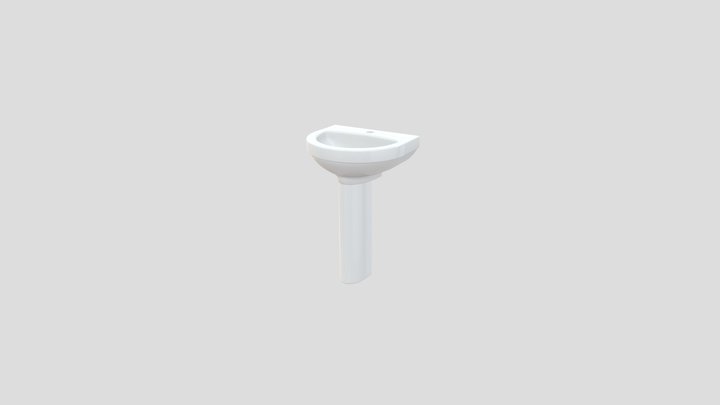
Identify the location of basin. This screenshot has height=405, width=720. (346, 145).